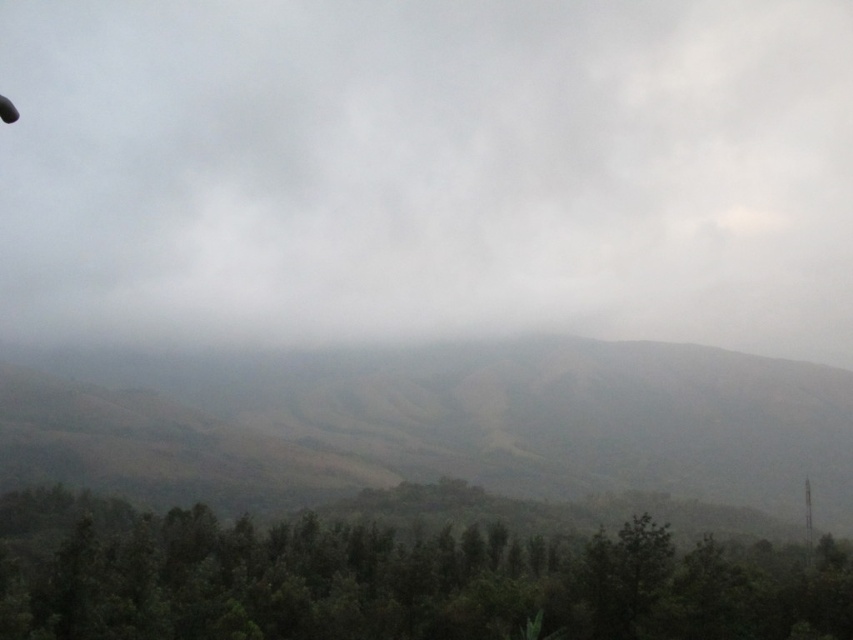
Question: Is gray matte cloud at upper center bigger than green matte trees at lower center?

Choices:
 (A) no
 (B) yes

Answer: (B)

Question: Can you confirm if gray matte cloud at upper center is bigger than brown matte mountain at center?

Choices:
 (A) yes
 (B) no

Answer: (A)

Question: Which of the following is the closest to the observer?

Choices:
 (A) (109, 193)
 (B) (651, 636)

Answer: (B)

Question: Which point is closer to the camera?

Choices:
 (A) (132, 518)
 (B) (485, 364)

Answer: (A)

Question: Does gray matte cloud at upper center appear on the left side of green matte trees at lower center?

Choices:
 (A) no
 (B) yes

Answer: (A)

Question: Among these objects, which one is farthest from the camera?

Choices:
 (A) gray matte cloud at upper center
 (B) green matte trees at lower center
 (C) brown matte mountain at center

Answer: (A)